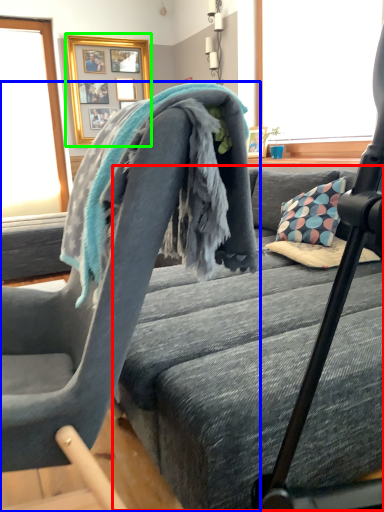
Question: Estimate the real-world distances between objects in this image. Which object is closer to bed frame (highlighted by a red box), chair (highlighted by a blue box) or picture frame (highlighted by a green box)?

Choices:
 (A) chair
 (B) picture frame

Answer: (A)